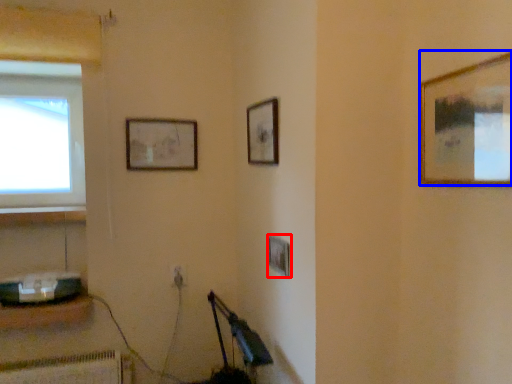
Question: Which of the following is the farthest to the observer, picture frame (highlighted by a red box) or picture frame (highlighted by a blue box)?

Choices:
 (A) picture frame
 (B) picture frame

Answer: (A)